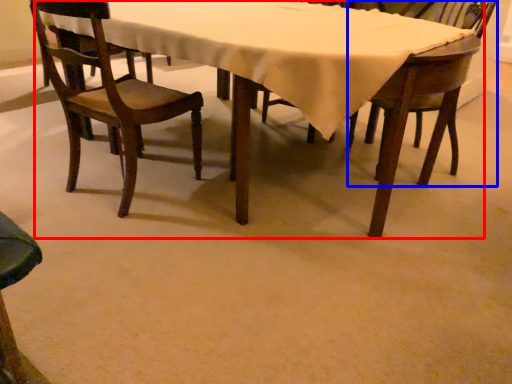
Question: Which object appears closest to the camera in this image, kitchen & dining room table (highlighted by a red box) or chair (highlighted by a blue box)?

Choices:
 (A) kitchen & dining room table
 (B) chair

Answer: (A)